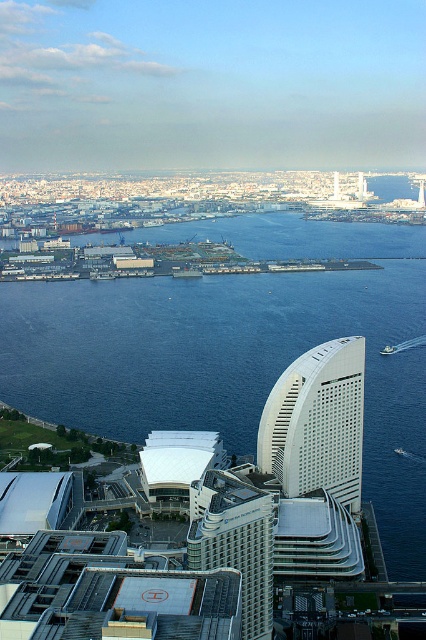
Is blue water at center shorter than white textured building at center-right?

No, blue water at center is not shorter than white textured building at center-right.

Can you confirm if blue water at center is positioned above white textured building at center-right?

Correct, blue water at center is located above white textured building at center-right.

Between point (373, 369) and point (313, 396), which one is positioned behind?

The point (373, 369) is more distant.

Identify the location of blue water at center. (238, 348).

Consider the image. Can you confirm if white textured building at center-right is bigger than white textured building at center?

→ Yes, white textured building at center-right is bigger than white textured building at center.

Does white textured building at center-right come in front of white textured building at center?

That is False.

Does point (307, 449) come behind point (258, 500)?

Yes, point (307, 449) is farther from viewer.

Identify the location of white textured building at center-right. (316, 422).

Consider the image. Can you confirm if blue water at center is wider than white textured building at center?

Yes, blue water at center is wider than white textured building at center.

Does blue water at center appear on the right side of white textured building at center?

No, blue water at center is not to the right of white textured building at center.

What do you see at coordinates (238, 348) in the screenshot?
I see `blue water at center` at bounding box center [238, 348].

Find the location of `blue water at center`. blue water at center is located at coordinates (238, 348).